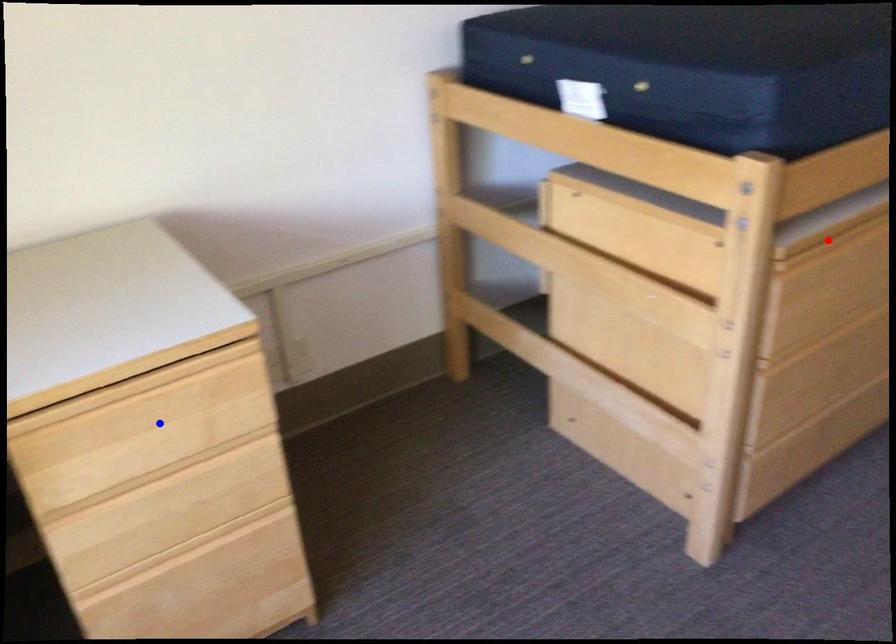
Question: In the image, two points are highlighted. Which point is nearer to the camera? Reply with the corresponding letter.

Choices:
 (A) blue point
 (B) red point

Answer: (A)